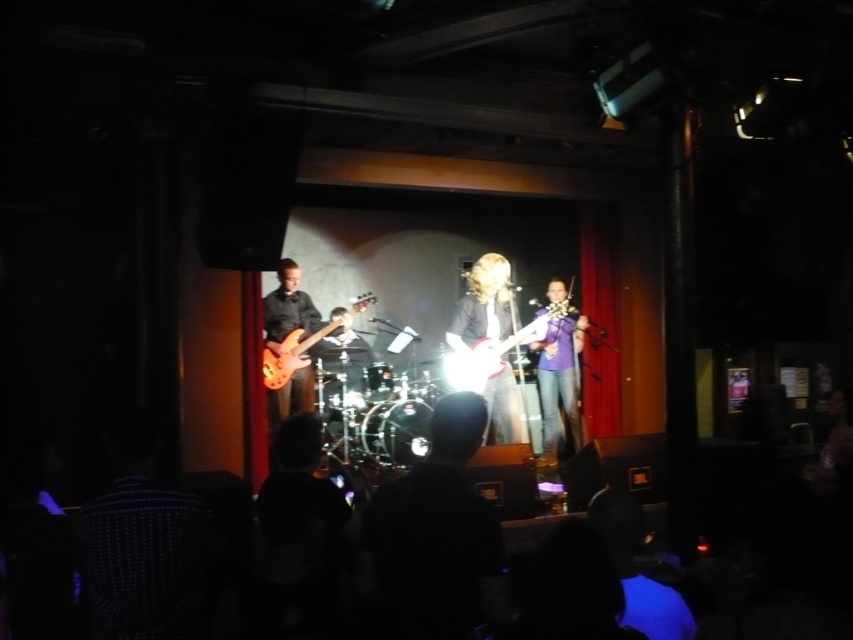
The width and height of the screenshot is (853, 640). Describe the element at coordinates (489, 340) in the screenshot. I see `shiny silver guitar at center` at that location.

Find the location of `shiny silver guitar at center`. shiny silver guitar at center is located at coordinates (489, 340).

Is point (538, 392) in front of point (453, 385)?

No.

Does point (572, 314) come farther from viewer compared to point (454, 320)?

That is True.

Which is in front, point (538, 358) or point (486, 368)?

Point (486, 368) is more forward.

Find the location of a particular element. Image resolution: width=853 pixels, height=640 pixels. purple fabric violin at center is located at coordinates (558, 381).

Does shiny silver guitar at center have a greater height compared to shiny red electric guitar at center?

Yes, shiny silver guitar at center is taller than shiny red electric guitar at center.

Who is taller, shiny silver guitar at center or shiny red electric guitar at center?

shiny silver guitar at center

Find the location of a particular element. Image resolution: width=853 pixels, height=640 pixels. shiny silver guitar at center is located at coordinates (489, 340).